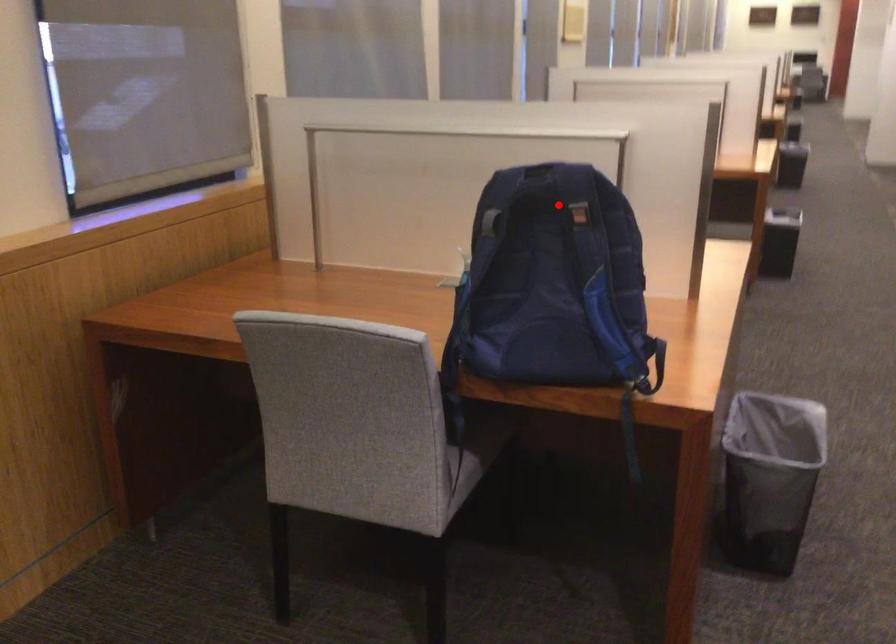
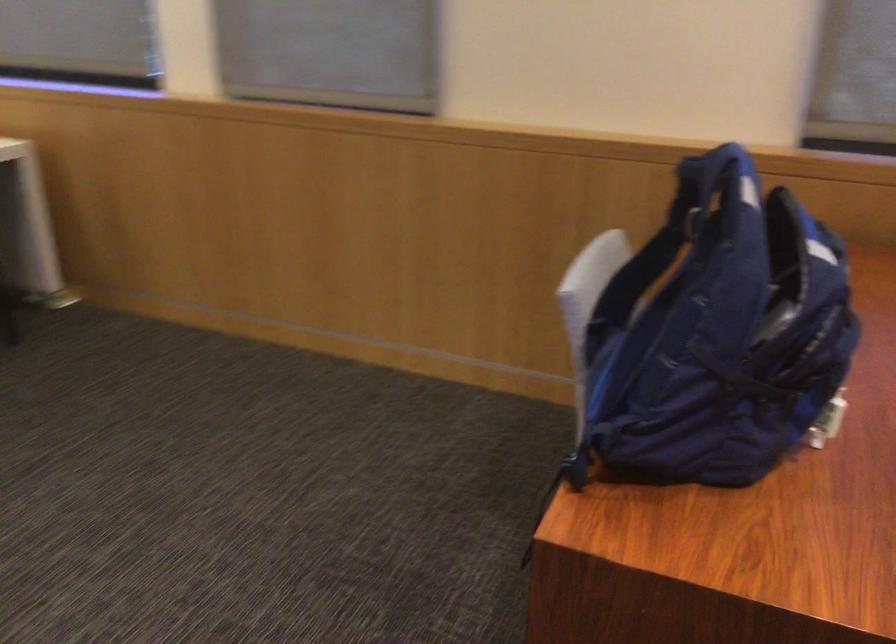
Question: I am providing you with two images of the same scene from different viewpoints. In image1, a red point is highlighted. Considering the same 3D point in image2, which of the following is correct?

Choices:
 (A) It is closer
 (B) It is farther

Answer: (A)